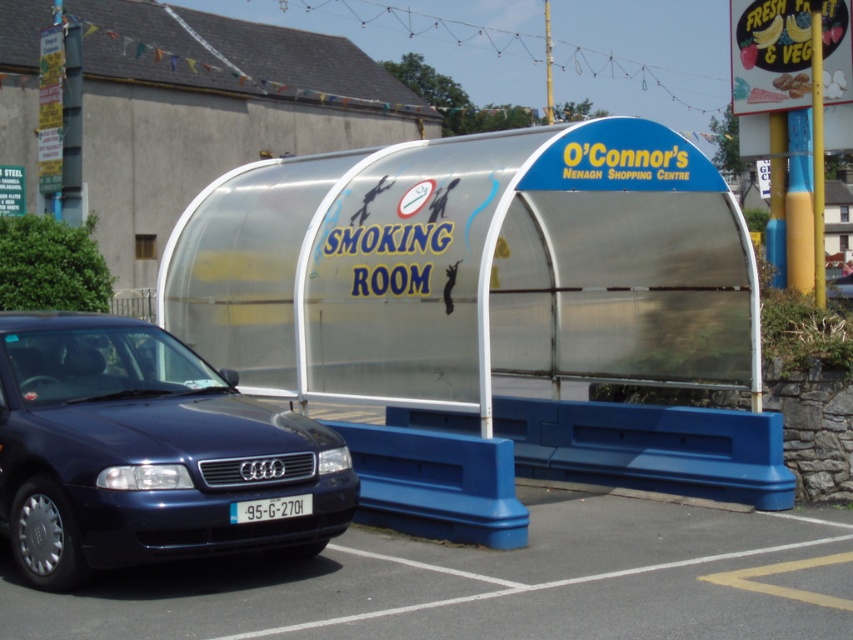
You are standing at the entrance of the OConnor s NENAGH SHOPPING CENTRE smoking room and want to park your car in the nearest available spot. You see a metallic blue sedan at lower left. Based on its position, can you estimate whether the parking spot directly in front of the smoking room is occupied?

The metallic blue sedan at lower left is parked at point (144, 452), which indicates it is occupying the parking spot directly in front of the smoking room.

You are a parking attendant who needs to direct a car to park between the metallic blue sedan at lower left and the white plastic license plate at center. Is there enough space for the new car to park there?

The metallic blue sedan at lower left is positioned on the left side of white plastic license plate at center, meaning there is no space between them for another car to park.

You are standing in front of the smoking room and want to walk to the smooth asphalt parking lot at lower left. Is the white plastic license plate at center blocking your path?

The smooth asphalt parking lot at lower left has a lesser height compared to the white plastic license plate at center. Since the license plate is taller, it might block your path depending on its position, but the description doesn not specify horizontal placement. However, based on the given information, the license plate is higher, so if you walk around it, you can reach the parking lot.